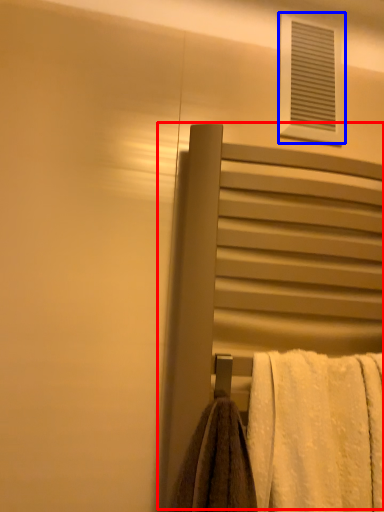
Question: Among these objects, which one is nearest to the camera, screen door (highlighted by a red box) or window (highlighted by a blue box)?

Choices:
 (A) screen door
 (B) window

Answer: (A)